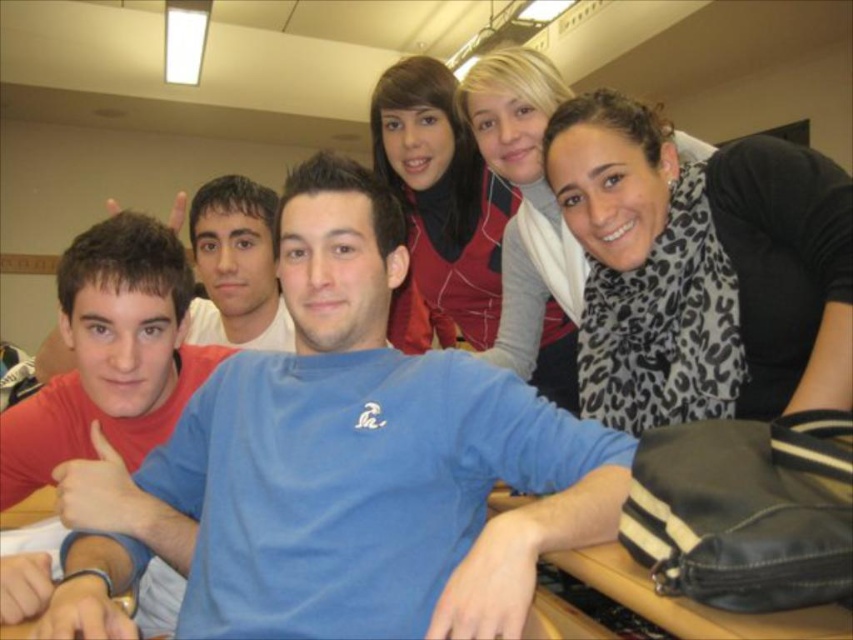
You are a photographer trying to adjust the lighting for a group photo. You notice the matte blue shirt at center and the leopard print scarf at upper right. Which object is closer to the camera?

The matte blue shirt at center is closer to the camera because it is in front of the leopard print scarf at upper right.

You are a photographer trying to adjust the lighting in the scene. You need to place a spotlight so that it illuminates both the leopard print scarf at upper right and the matte blue shirt at left. Considering their positions, which object should the spotlight be angled higher to reach?

The leopard print scarf at upper right is much taller as matte blue shirt at left, so the spotlight should be angled higher to reach the leopard print scarf at upper right.

Looking at the photo of the group, where is the leopard print scarf at upper right in relation to the matte blue shirt at left?

The leopard print scarf at upper right is to the right of the matte blue shirt at left.